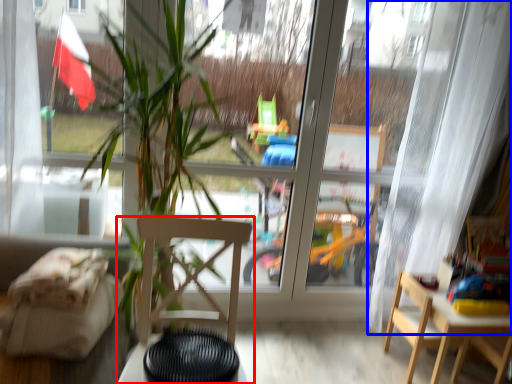
Question: Which point is closer to the camera, chair (highlighted by a red box) or curtain (highlighted by a blue box)?

Choices:
 (A) chair
 (B) curtain

Answer: (A)